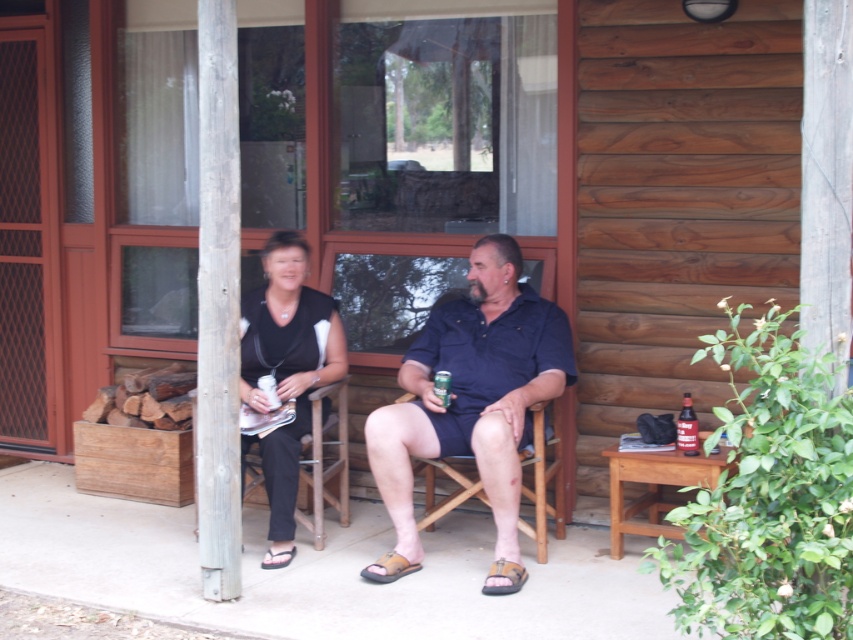
Between dark blue shirt at center and brown leather sandal at lower center, which one is positioned lower?

brown leather sandal at lower center

The height and width of the screenshot is (640, 853). Describe the element at coordinates (473, 390) in the screenshot. I see `dark blue shirt at center` at that location.

Does point (488, 244) come behind point (287, 554)?

Yes.

The height and width of the screenshot is (640, 853). What are the coordinates of `dark blue shirt at center` in the screenshot? It's located at (473, 390).

Is wooden chair at center bigger than brown leather sandal at center?

Correct, wooden chair at center is larger in size than brown leather sandal at center.

Measure the distance between point (460, 490) and camera.

They are 5.27 meters apart.

What do you see at coordinates (543, 481) in the screenshot?
I see `wooden chair at center` at bounding box center [543, 481].

Where is `wooden chair at center`? The height and width of the screenshot is (640, 853). wooden chair at center is located at coordinates (543, 481).

Does point (271, 264) come farther from viewer compared to point (276, 563)?

Yes.

This screenshot has height=640, width=853. Identify the location of black fabric shirt at center. (286, 365).